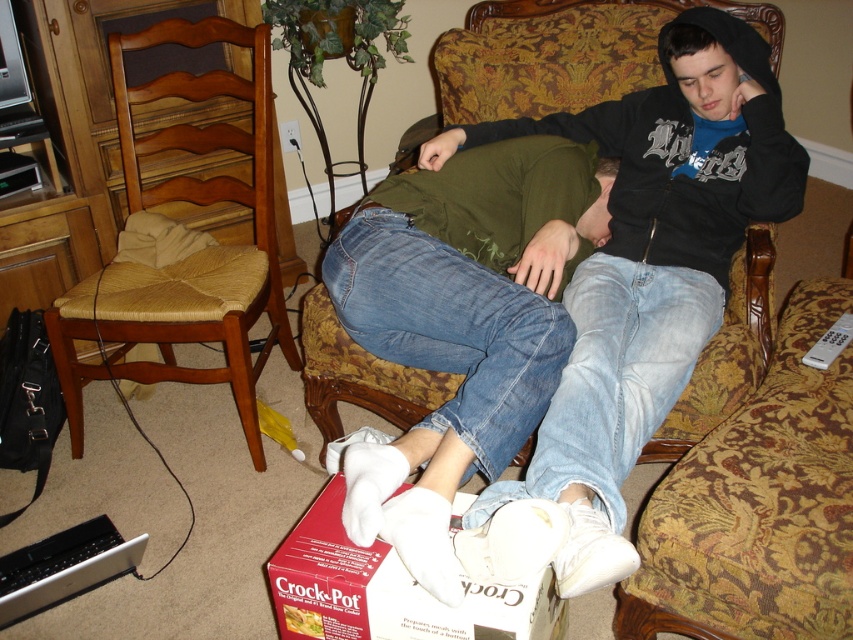
Question: Which point is closer to the camera taking this photo?

Choices:
 (A) (248, 321)
 (B) (398, 593)

Answer: (B)

Question: Which object is farther from the camera taking this photo?

Choices:
 (A) brown woven wood chair at left
 (B) gold-patterned armchair at upper center
 (C) white cotton socks at lower center
 (D) white plastic remote at lower right

Answer: (B)

Question: Is white cotton socks at lower center smaller than matte red crock-pot at lower center?

Choices:
 (A) no
 (B) yes

Answer: (A)

Question: Which object appears farthest from the camera in this image?

Choices:
 (A) brown woven wood chair at left
 (B) gold-patterned armchair at upper center
 (C) white plastic remote at lower right

Answer: (B)

Question: Can you confirm if matte red crock-pot at lower center is thinner than white suede shoe at lower center?

Choices:
 (A) yes
 (B) no

Answer: (B)

Question: Does matte red crock-pot at lower center come behind white suede shoe at lower center?

Choices:
 (A) yes
 (B) no

Answer: (A)